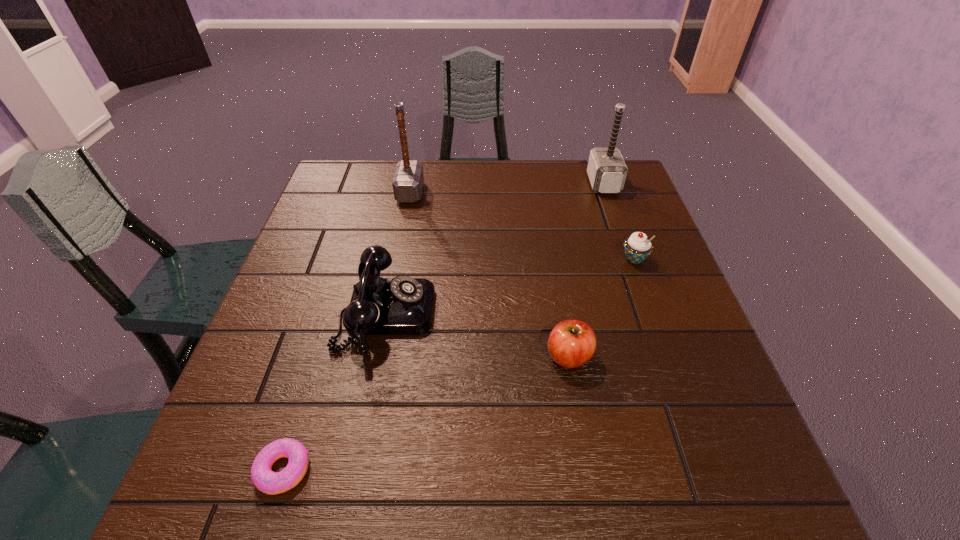
Image resolution: width=960 pixels, height=540 pixels. Find the location of `object that is at the near left corner`. object that is at the near left corner is located at coordinates (265, 480).

At what (x,y) coordinates should I click in order to perform the action: click on object located at the far right corner. Please return your answer as a coordinate pair (x, y). This screenshot has width=960, height=540. Looking at the image, I should click on pos(606,169).

Find the location of `free space at the far edge of the desktop`. free space at the far edge of the desktop is located at coordinates (494, 198).

Find the location of a particular element. This screenshot has height=540, width=960. vacant space at the near edge of the desktop is located at coordinates (604, 507).

At what (x,y) coordinates should I click in order to perform the action: click on vacant space at the left edge. Please return your answer as a coordinate pair (x, y). Looking at the image, I should click on (317, 334).

You are a GUI agent. You are given a task and a screenshot of the screen. Output one action in this format:
    pyautogui.click(x=<x>, y=<y>)
    Task: Click on the free location at the right edge of the desktop
    
    Given the screenshot: What is the action you would take?
    pyautogui.click(x=696, y=377)

In the image, there is a desktop. Where is `vacant space at the far left corner`? This screenshot has height=540, width=960. vacant space at the far left corner is located at coordinates (370, 182).

Identify the location of free space at the near left corner of the desktop. The height and width of the screenshot is (540, 960). (235, 468).

Where is `free spot between the doughnut and the fourth nearest object`? Image resolution: width=960 pixels, height=540 pixels. free spot between the doughnut and the fourth nearest object is located at coordinates pyautogui.click(x=459, y=364).

Image resolution: width=960 pixels, height=540 pixels. I want to click on vacant area that lies between the telephone and the shortest object, so click(335, 391).